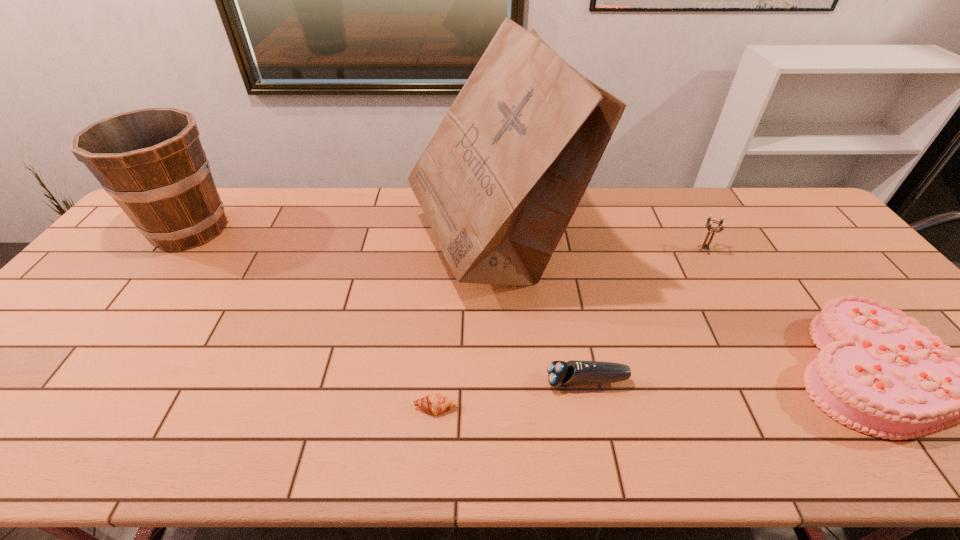
The height and width of the screenshot is (540, 960). In the image, there is a desktop. What are the coordinates of `vacant space at the far right corner` in the screenshot? It's located at (776, 209).

Where is `vacant area between the tallest object and the bucket`? vacant area between the tallest object and the bucket is located at coordinates (342, 238).

Locate an element on the screen. The height and width of the screenshot is (540, 960). vacant region between the bucket and the electric shaver is located at coordinates (388, 305).

Locate an element on the screen. The image size is (960, 540). unoccupied area between the fifth tallest object and the third tallest object is located at coordinates (645, 316).

Find the location of a particular element. blank region between the candle holder and the grocery bag is located at coordinates (598, 249).

Identify the location of vacant space in between the pastry and the grocery bag. This screenshot has height=540, width=960. (465, 328).

Image resolution: width=960 pixels, height=540 pixels. What are the coordinates of `empty space that is in between the third tallest object and the grocery bag` in the screenshot? It's located at (598, 249).

At what (x,y) coordinates should I click in order to perform the action: click on empty space between the second shortest object and the shortest object. Please return your answer as a coordinate pair (x, y). The height and width of the screenshot is (540, 960). Looking at the image, I should click on (512, 395).

Locate which object is the fifth closest to the fifth object from left to right. Please provide its 2D coordinates. Your answer should be formatted as a tuple, i.e. [(x, y)], where the tuple contains the x and y coordinates of a point satisfying the conditions above.

[(151, 161)]

Locate an element on the screen. object that stands as the fifth closest to the fifth object from left to right is located at coordinates (151, 161).